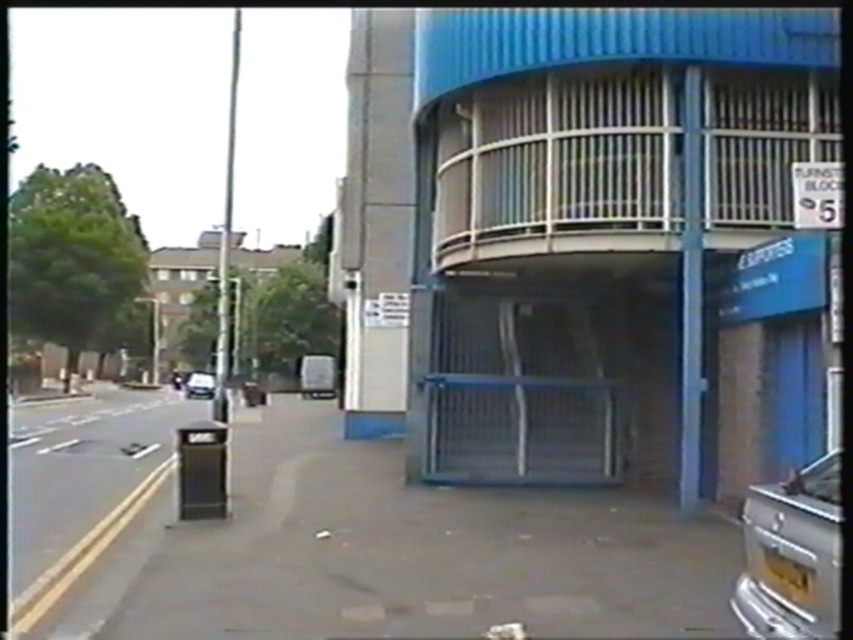
Question: Which of the following is the farthest from the observer?

Choices:
 (A) (160, 477)
 (B) (19, 467)

Answer: (B)

Question: Which is farther from the smooth concrete pavement at center?

Choices:
 (A) shiny silver car at lower right
 (B) black asphalt pavement at lower left

Answer: (A)

Question: Is shiny silver car at lower right to the left of shiny silver car at center from the viewer's perspective?

Choices:
 (A) yes
 (B) no

Answer: (B)

Question: Observing the image, what is the correct spatial positioning of smooth concrete pavement at center in reference to shiny silver car at center?

Choices:
 (A) left
 (B) right

Answer: (B)

Question: Estimate the real-world distances between objects in this image. Which object is farther from the shiny silver car at center?

Choices:
 (A) shiny silver car at lower right
 (B) smooth concrete pavement at center
 (C) black asphalt pavement at lower left

Answer: (A)

Question: Does black asphalt pavement at lower left lie behind shiny silver car at center?

Choices:
 (A) no
 (B) yes

Answer: (A)